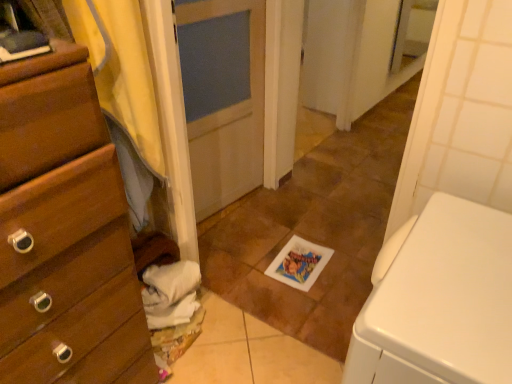
Question: Is yellow fabric at left bigger or smaller than white glossy tile at center?

Choices:
 (A) big
 (B) small

Answer: (B)

Question: From their relative heights in the image, would you say yellow fabric at left is taller or shorter than white glossy tile at center?

Choices:
 (A) tall
 (B) short

Answer: (A)

Question: Which object is positioned farthest from the white glossy tile at center?

Choices:
 (A) wooden chest of drawers at left
 (B) yellow fabric at left
 (C) white cotton towels at lower left

Answer: (A)

Question: Based on their relative distances, which object is nearer to the yellow fabric at left?

Choices:
 (A) wooden chest of drawers at left
 (B) white cotton towels at lower left
 (C) white glossy tile at center

Answer: (A)